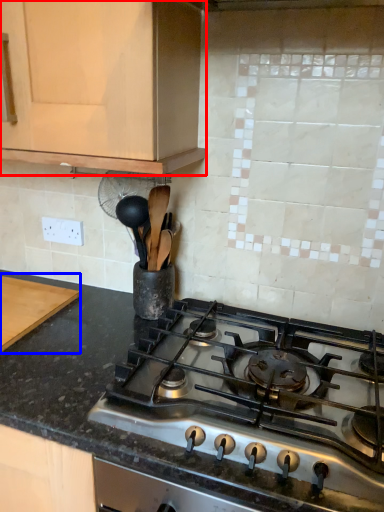
Question: Which object appears farthest to the camera in this image, cabinetry (highlighted by a red box) or cutting board (highlighted by a blue box)?

Choices:
 (A) cabinetry
 (B) cutting board

Answer: (B)